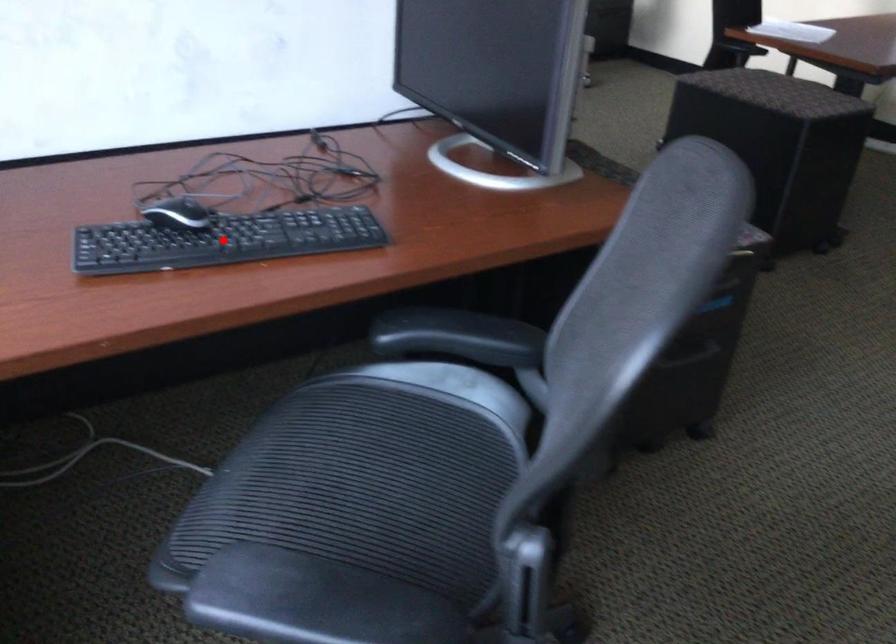
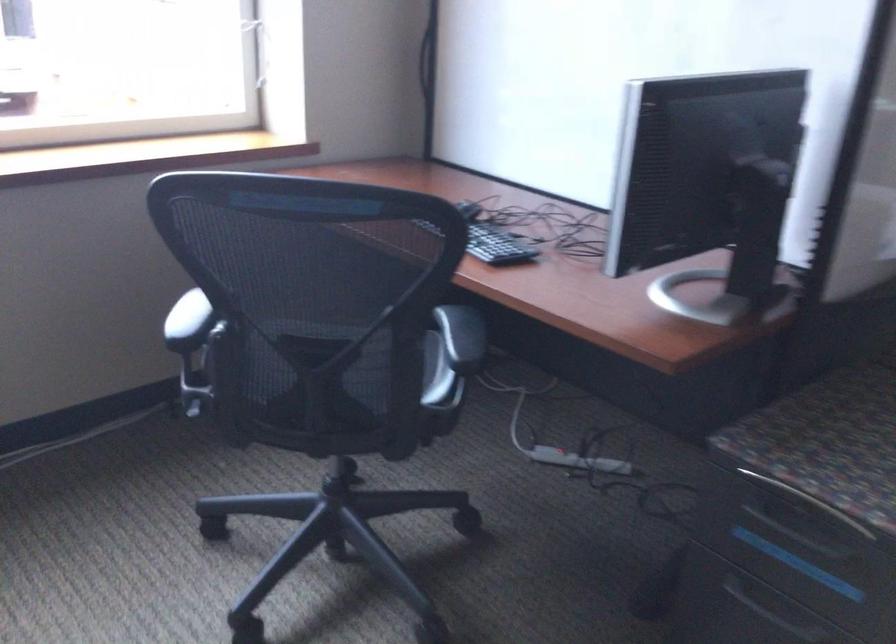
Question: I am providing you with two images of the same scene from different viewpoints. A red point is marked on the first image. At the location where the point appears in image 1, is it still visible in image 2?

Choices:
 (A) Yes
 (B) No

Answer: (B)